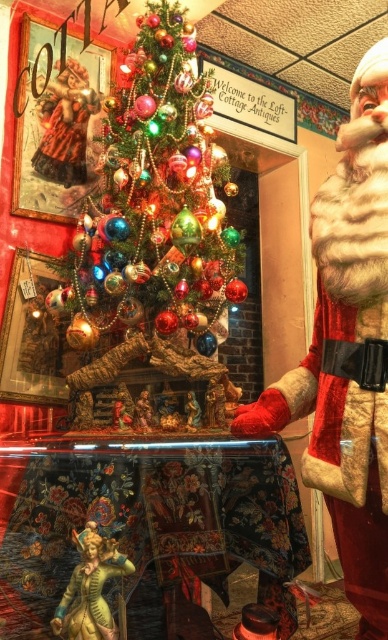
You are a customer in the antique shop and want to locate the fuzzy fur santa at right and the gold metallic statue at lower left. According to the store layout, which one is positioned more towards the east side of the room?

The fuzzy fur santa at right is to the right of gold metallic statue at lower left, so the fuzzy fur santa at right is positioned more towards the east side of the room.

You are standing in the antique shop and need to place a new decoration between the two points marked as point (x=209, y=204) and point (x=384, y=420). Which point should you move towards to ensure the decoration is placed closer to the back of the room?

You should move towards point (x=209, y=204) because it is located behind point (x=384, y=420), so placing the decoration there would position it closer to the back of the room.

You are standing in the Cottage Antiques shop and notice two points marked in the scene. The first point is at coordinate (344, 392) and the second is at (65, 602). Which of these points is nearer to you as you stand in the shop?

Point (344, 392) is closer to the viewer than point (65, 602).